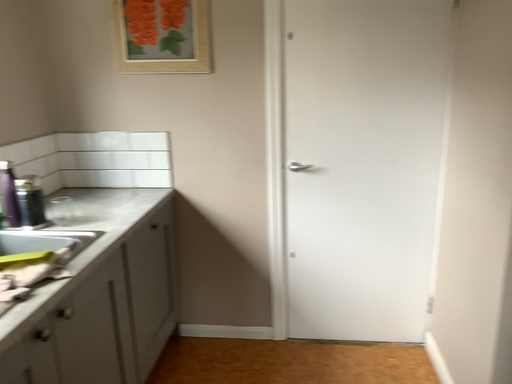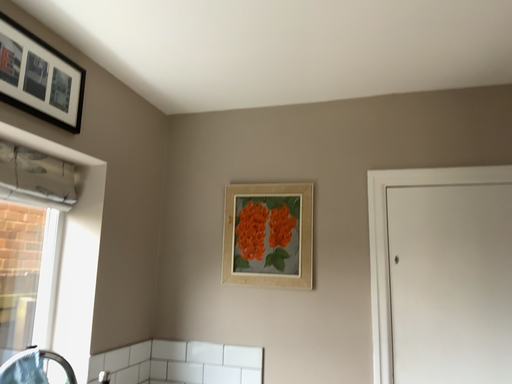
Question: Which way did the camera rotate in the video?

Choices:
 (A) rotated downward
 (B) rotated upward

Answer: (B)